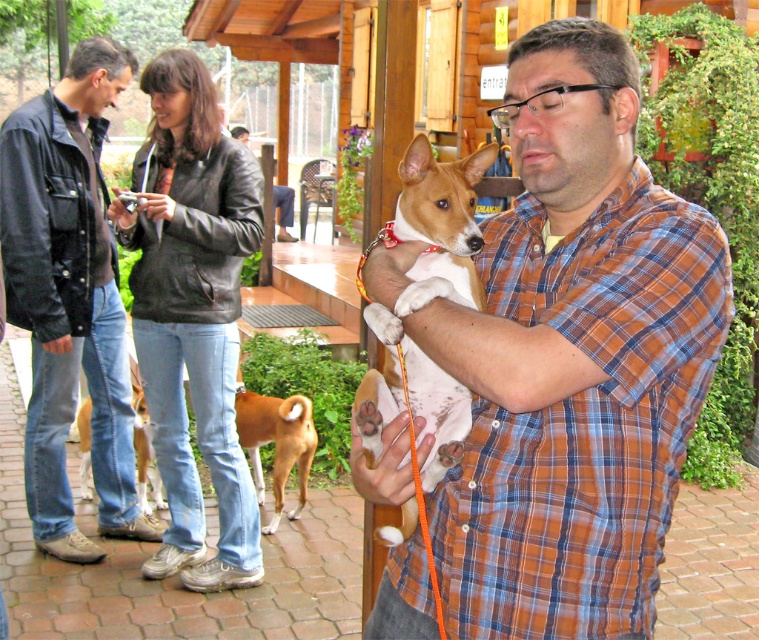
Measure the distance between matte plaid shirt at center and camera.

matte plaid shirt at center and camera are 4.92 feet apart.

Is matte plaid shirt at center taller than brown furry dog at lower center?

Incorrect, matte plaid shirt at center's height is not larger of brown furry dog at lower center's.

What do you see at coordinates (591, 312) in the screenshot? I see `matte plaid shirt at center` at bounding box center [591, 312].

The height and width of the screenshot is (640, 759). I want to click on matte plaid shirt at center, so click(591, 312).

Does matte plaid shirt at center have a larger size compared to brown fur dog at lower left?

Actually, matte plaid shirt at center might be smaller than brown fur dog at lower left.

Can you confirm if matte plaid shirt at center is positioned to the left of brown fur dog at lower left?

In fact, matte plaid shirt at center is to the right of brown fur dog at lower left.

Who is more distant from viewer, (x=521, y=308) or (x=140, y=440)?

The point (x=140, y=440) is behind.

I want to click on matte plaid shirt at center, so click(591, 312).

Can you confirm if white fur dog at center is positioned below brown furry dog at lower center?

No, white fur dog at center is not below brown furry dog at lower center.

Between point (443, 216) and point (241, 436), which one is positioned behind?

Positioned behind is point (241, 436).

Is point (398, 372) more distant than point (288, 413)?

No, it is in front of (288, 413).

Locate an element on the screen. white fur dog at center is located at coordinates (427, 301).